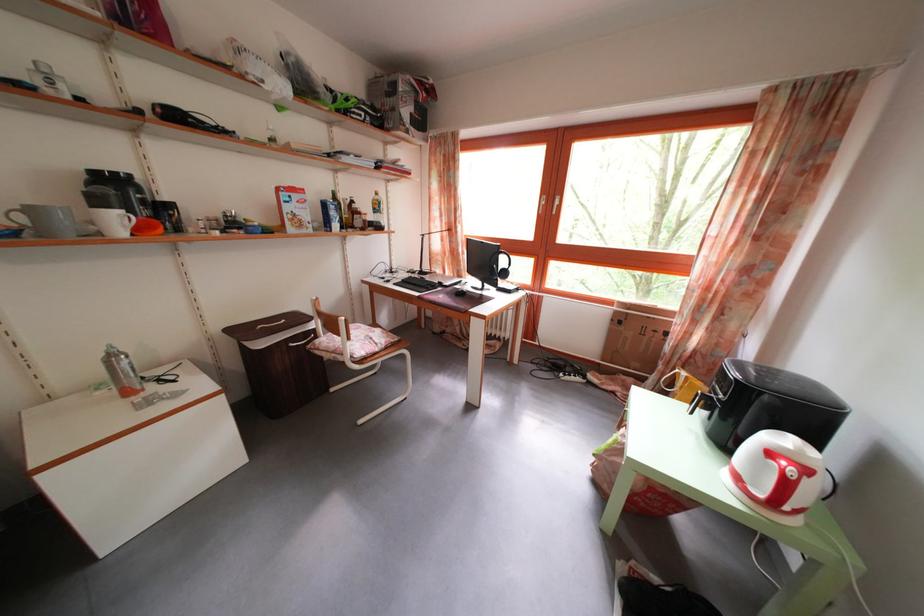
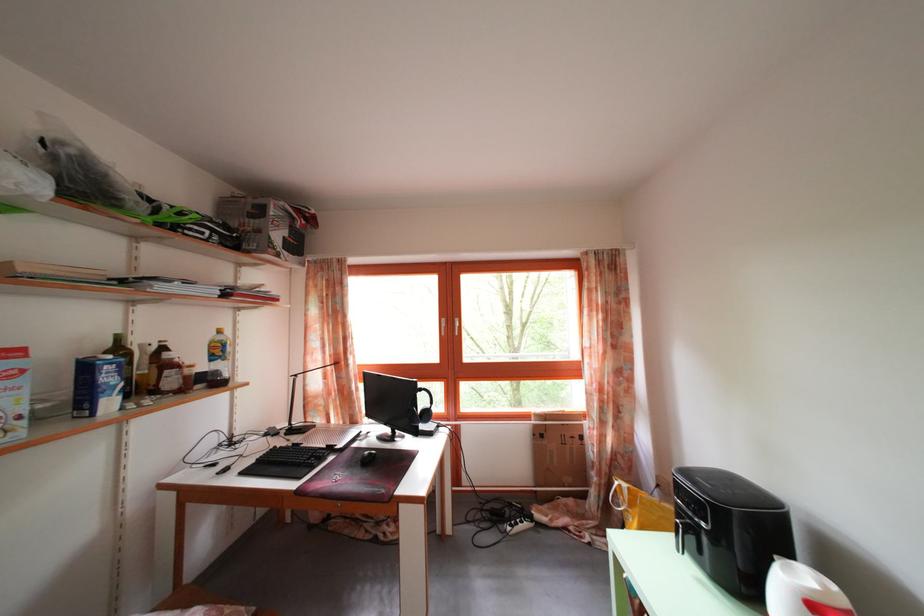
Locate, in the second image, the point that corresponds to point (429, 294) in the first image.

(307, 472)